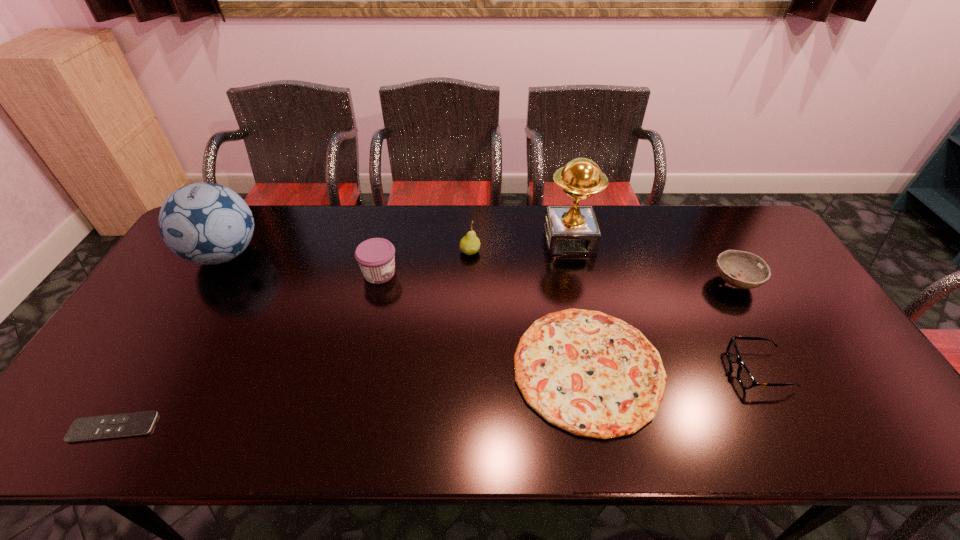
This screenshot has height=540, width=960. What are the coordinates of `the tallest object` in the screenshot? It's located at (570, 230).

Find the location of a particular element. The height and width of the screenshot is (540, 960). the seventh shortest object is located at coordinates (205, 223).

I want to click on pear, so click(470, 244).

Identify the location of the third object from left to right. The image size is (960, 540). (376, 257).

Locate an element on the screen. The image size is (960, 540). jam is located at coordinates (376, 257).

Locate an element on the screen. the fourth shortest object is located at coordinates (750, 271).

This screenshot has width=960, height=540. I want to click on the sixth tallest object, so click(x=744, y=376).

Where is `the second shortest object`? This screenshot has height=540, width=960. the second shortest object is located at coordinates (591, 374).

Identify the location of remote control. pyautogui.click(x=138, y=423).

Where is `free point located on the front-facing side of the award`? free point located on the front-facing side of the award is located at coordinates (590, 334).